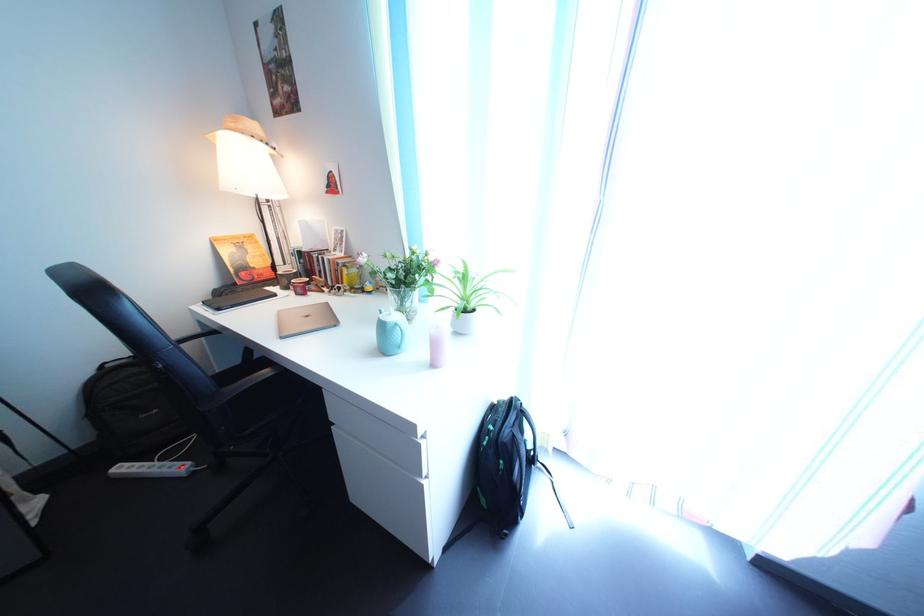
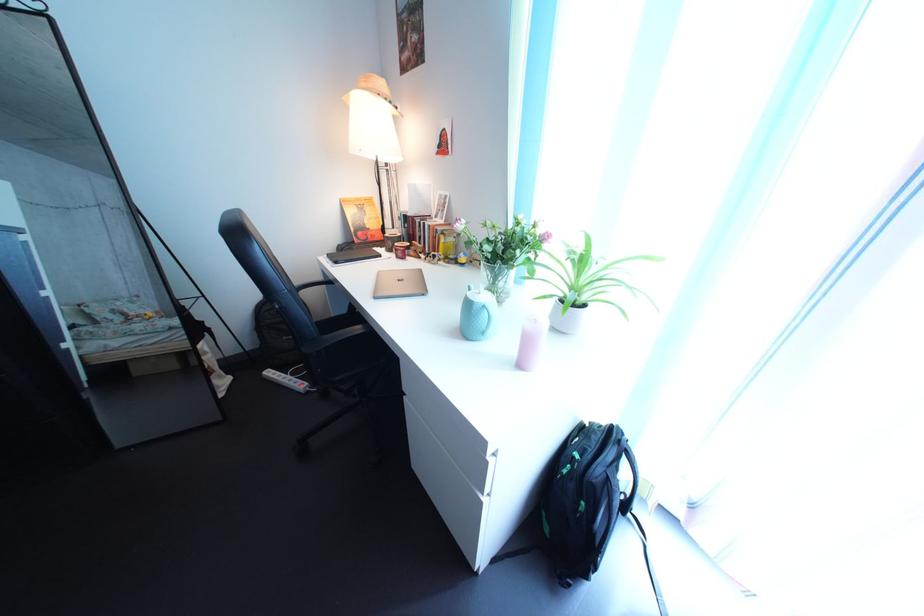
Locate, in the second image, the point that corresponds to [457,317] in the first image.

(560, 305)